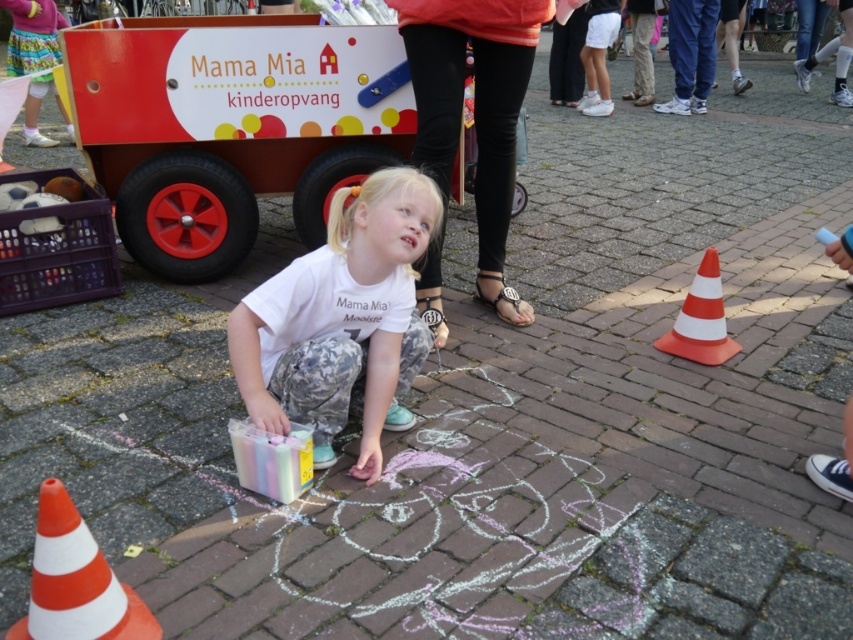
Who is taller, pastel cotton skirt at upper left or orange/white striped cone at right?

pastel cotton skirt at upper left is taller.

Between pastel cotton skirt at upper left and orange/white striped cone at right, which one has less height?

orange/white striped cone at right

Describe the element at coordinates (35, 60) in the screenshot. I see `pastel cotton skirt at upper left` at that location.

You are a GUI agent. You are given a task and a screenshot of the screen. Output one action in this format:
    pyautogui.click(x=<x>, y=<y>)
    Task: Click on the pastel cotton skirt at upper left
    
    Given the screenshot: What is the action you would take?
    pyautogui.click(x=35, y=60)

Is matte white wagon at center smaller than orange/white plastic cone at lower left?

Actually, matte white wagon at center might be larger than orange/white plastic cone at lower left.

Is point (349, 33) in front of point (53, 518)?

No, it is behind (53, 518).

At what (x,y) coordinates should I click in order to perform the action: click on matte white wagon at center. Please return your answer as a coordinate pair (x, y). This screenshot has height=640, width=853. Looking at the image, I should click on (231, 125).

Based on the photo, does orange/white plastic cone at lower left have a lesser height compared to orange/white striped cone at right?

Yes, orange/white plastic cone at lower left is shorter than orange/white striped cone at right.

What do you see at coordinates (76, 580) in the screenshot? The image size is (853, 640). I see `orange/white plastic cone at lower left` at bounding box center [76, 580].

Identify the location of orange/white plastic cone at lower left. The image size is (853, 640). (76, 580).